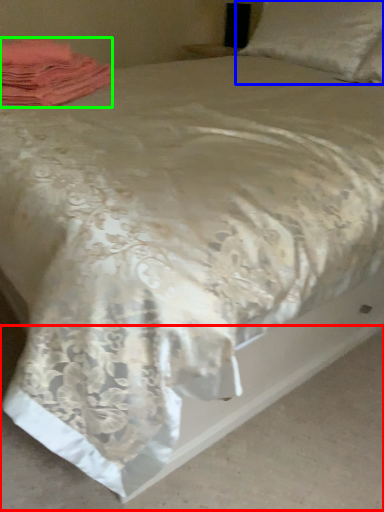
Question: Which object is the closest to the concrete (highlighted by a red box)? Choose among these: pillow (highlighted by a blue box) or material (highlighted by a green box).

Choices:
 (A) pillow
 (B) material

Answer: (B)